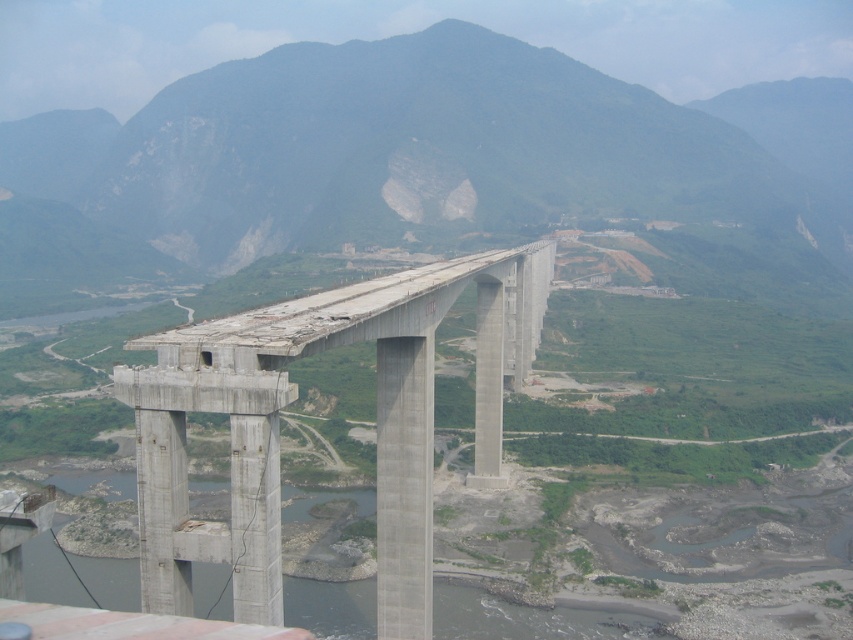
Is green rock mountain at center taller than concrete bridge at center?

Yes, green rock mountain at center is taller than concrete bridge at center.

Who is shorter, green rock mountain at center or concrete bridge at center?

With less height is concrete bridge at center.

Between point (265, 161) and point (195, 520), which one is positioned behind?

The point (265, 161) is more distant.

Where is `green rock mountain at center`? The image size is (853, 640). green rock mountain at center is located at coordinates (426, 161).

This screenshot has width=853, height=640. What do you see at coordinates (296, 397) in the screenshot?
I see `concrete bridge at center` at bounding box center [296, 397].

Is concrete bridge at center further to camera compared to gray concrete river at lower center?

Yes, it is behind gray concrete river at lower center.

The height and width of the screenshot is (640, 853). Describe the element at coordinates (296, 397) in the screenshot. I see `concrete bridge at center` at that location.

The height and width of the screenshot is (640, 853). In order to click on concrete bridge at center in this screenshot , I will do `click(296, 397)`.

From the picture: Which is above, green rock mountain at center or gray concrete river at lower center?

Positioned higher is green rock mountain at center.

What do you see at coordinates (426, 161) in the screenshot? I see `green rock mountain at center` at bounding box center [426, 161].

Where is `green rock mountain at center`? The width and height of the screenshot is (853, 640). green rock mountain at center is located at coordinates (426, 161).